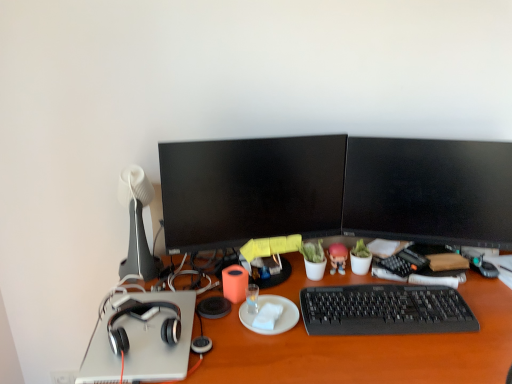
At what (x,y) coordinates should I click in order to perform the action: click on free space in front of white matte notepad at center. Please return your answer as a coordinate pair (x, y). Looking at the image, I should click on click(273, 355).